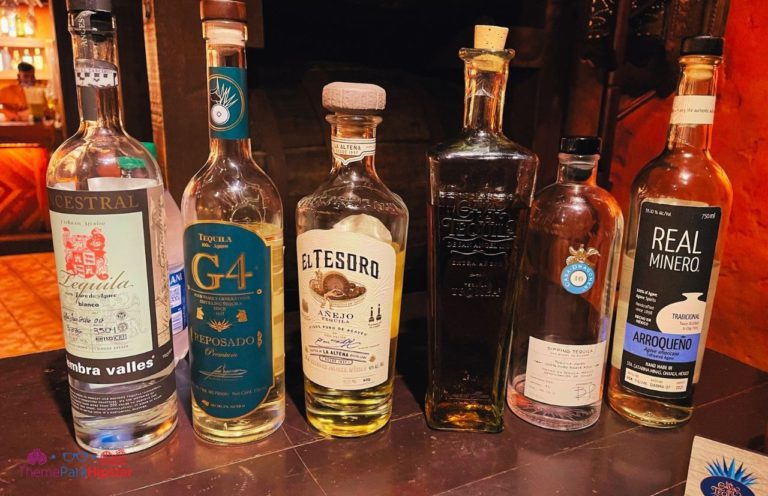
You are a GUI agent. You are given a task and a screenshot of the screen. Output one action in this format:
    pyautogui.click(x=<x>, y=<y>)
    Task: Click on the liquor bottle
    Image resolution: width=768 pixels, height=496 pixels.
    Given the screenshot: What is the action you would take?
    pyautogui.click(x=682, y=216), pyautogui.click(x=568, y=254), pyautogui.click(x=480, y=224), pyautogui.click(x=372, y=254), pyautogui.click(x=213, y=277), pyautogui.click(x=137, y=272)